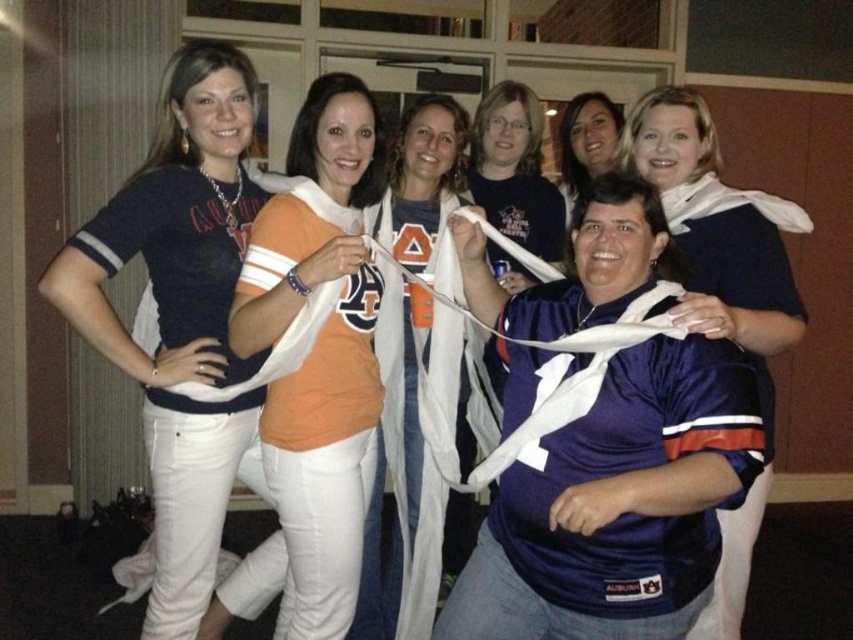
Between point (460, 605) and point (773, 205), which one is positioned behind?

Point (773, 205)

Can you confirm if purple satin jersey at center is thinner than satin blue jersey at center?

No.

Where is `purple satin jersey at center`? The height and width of the screenshot is (640, 853). purple satin jersey at center is located at coordinates (618, 504).

Is point (624, 618) closer to camera compared to point (244, 468)?

Yes.

Locate an element on the screen. This screenshot has height=640, width=853. purple satin jersey at center is located at coordinates (618, 504).

Is point (593, 456) farther from camera compared to point (241, 83)?

No, (593, 456) is closer to viewer.

Locate an element on the screen. Image resolution: width=853 pixels, height=640 pixels. purple satin jersey at center is located at coordinates (618, 504).

Does white fabric scarf at center have a smaller size compared to white fabric ribbon at center?

Incorrect, white fabric scarf at center is not smaller in size than white fabric ribbon at center.

Is white fabric scarf at center positioned behind white fabric ribbon at center?

Yes, white fabric scarf at center is behind white fabric ribbon at center.

Does point (444, 164) come farther from viewer compared to point (531, 436)?

That is True.

The height and width of the screenshot is (640, 853). Find the location of `white fabric scarf at center`. white fabric scarf at center is located at coordinates (398, 486).